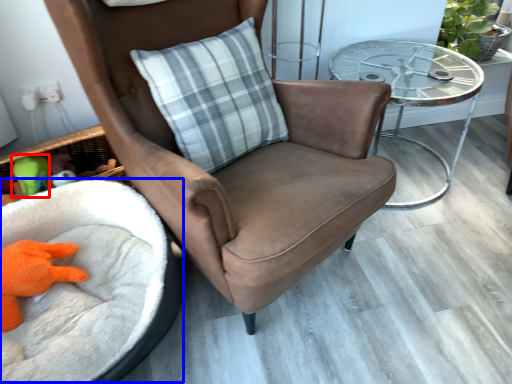
Question: Among these objects, which one is nearest to the camera, toy (highlighted by a red box) or infant bed (highlighted by a blue box)?

Choices:
 (A) toy
 (B) infant bed

Answer: (B)